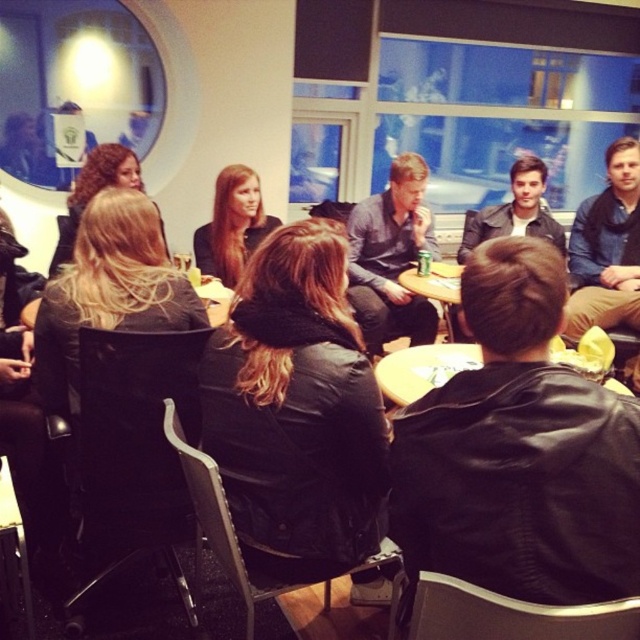
Question: Does black leather jacket at left appear over leather jacket at center?

Choices:
 (A) no
 (B) yes

Answer: (A)

Question: Does black leather jacket at left come behind blue denim jacket at upper right?

Choices:
 (A) no
 (B) yes

Answer: (A)

Question: Which point is farther from the camera taking this photo?

Choices:
 (A) (497, 323)
 (B) (458, 257)
 (C) (612, 285)
 (D) (211, 228)

Answer: (B)

Question: Which of the following is the closest to the observer?

Choices:
 (A) (84, 164)
 (B) (124, 268)
 (C) (204, 246)
 (D) (266, 451)

Answer: (D)

Question: Does blue denim jacket at upper right come in front of blonde hair at center?

Choices:
 (A) yes
 (B) no

Answer: (A)

Question: Which is nearer to the blonde hair at center?

Choices:
 (A) black leather jacket at left
 (B) black leather jacket at center
 (C) smooth brown hair at center
 (D) blue denim jacket at upper right

Answer: (C)